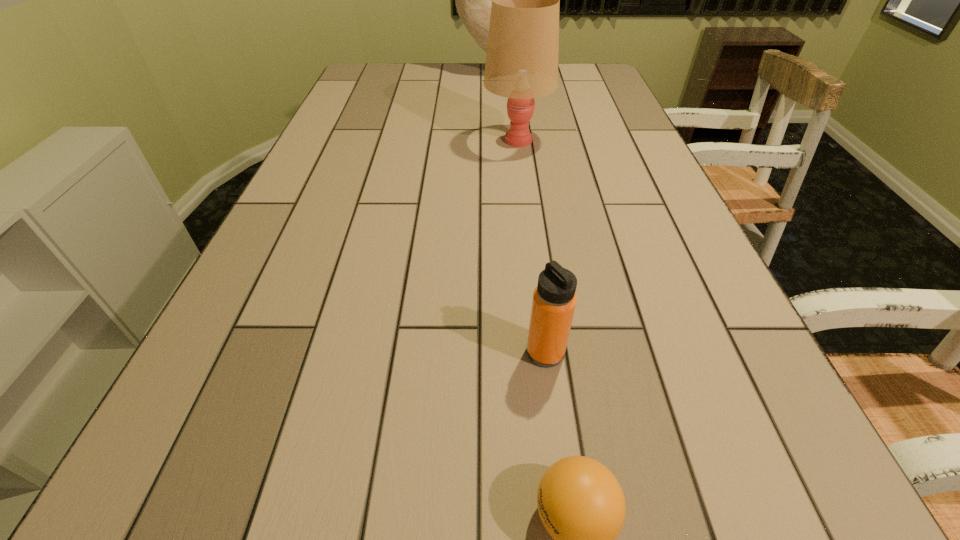
Identify the location of blank region between the thermos bottle and the lampshade. (531, 246).

Identify the location of vacant space in between the second shortest object and the parakeet. The width and height of the screenshot is (960, 540). (518, 213).

Locate which object ranks in proximity to the second farthest object. Please provide its 2D coordinates. Your answer should be formatted as a tuple, i.e. [(x, y)], where the tuple contains the x and y coordinates of a point satisfying the conditions above.

[(473, 0)]

Identify the location of the closest object to the parakeet. (521, 64).

Where is `free location that satisfies the following two spatial constraints: 1. on the face of the farthest object; 2. on the back side of the thermos bottle`? Image resolution: width=960 pixels, height=540 pixels. free location that satisfies the following two spatial constraints: 1. on the face of the farthest object; 2. on the back side of the thermos bottle is located at coordinates (505, 353).

Locate an element on the screen. free location that satisfies the following two spatial constraints: 1. on the face of the parakeet; 2. on the right side of the second shortest object is located at coordinates (505, 353).

At what (x,y) coordinates should I click in order to perform the action: click on free region that satisfies the following two spatial constraints: 1. on the face of the farthest object; 2. on the back side of the third farthest object. Please return your answer as a coordinate pair (x, y). The image size is (960, 540). Looking at the image, I should click on (505, 353).

Where is `free spot that satisfies the following two spatial constraints: 1. on the face of the farthest object; 2. on the back side of the lampshade`? This screenshot has height=540, width=960. free spot that satisfies the following two spatial constraints: 1. on the face of the farthest object; 2. on the back side of the lampshade is located at coordinates (495, 140).